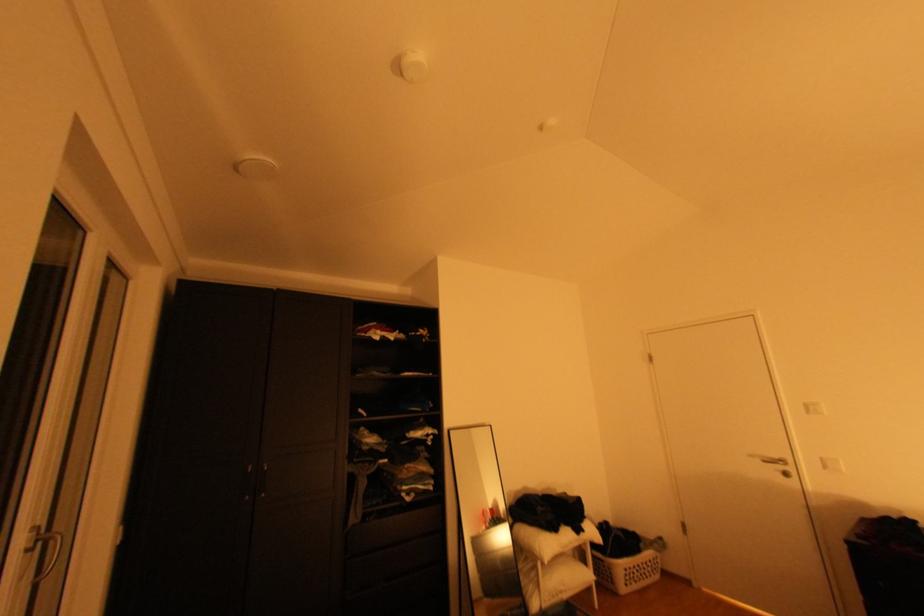
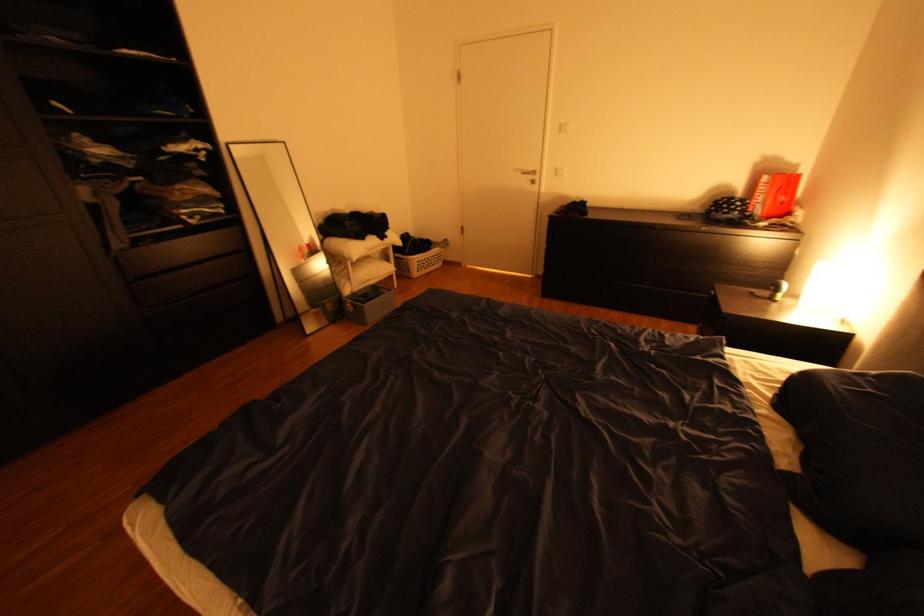
In the second image, find the point that corresponds to point (642, 573) in the first image.

(433, 264)